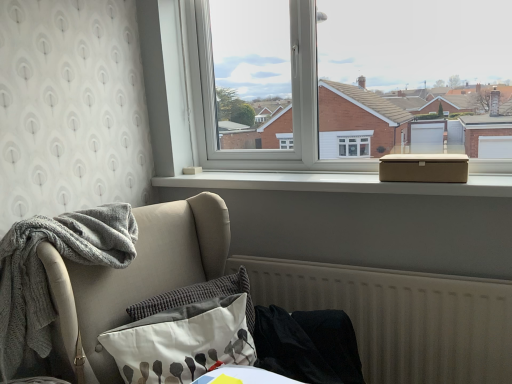
You are a GUI agent. You are given a task and a screenshot of the screen. Output one action in this format:
    pyautogui.click(x=<x>, y=<y>)
    Task: Click on the white smooth window sill at upper center
    
    Given the screenshot: What is the action you would take?
    coord(338,183)

The image size is (512, 384). Describe the element at coordinates (307, 345) in the screenshot. I see `black fabric at lower right, the 2th material positioned from the left` at that location.

This screenshot has width=512, height=384. What do you see at coordinates (424, 168) in the screenshot? I see `brown cardboard box at upper right` at bounding box center [424, 168].

Describe the element at coordinates (198, 297) in the screenshot. The width and height of the screenshot is (512, 384). I see `textured gray pillow at lower center, marked as the second pillow in a front-to-back arrangement` at that location.

The width and height of the screenshot is (512, 384). What do you see at coordinates (400, 317) in the screenshot?
I see `beige textured radiator at lower right` at bounding box center [400, 317].

Measure the distance between point (244, 323) and camera.

Point (244, 323) and camera are 1.39 meters apart from each other.

This screenshot has width=512, height=384. What are the coordinates of `white smooth window sill at upper center` in the screenshot? It's located at (338, 183).

Which object is further away from the camera, textured gray pillow at lower left, which is the 2th pillow from back to front, or black fabric at lower right, the 2th material positioned from the left?

black fabric at lower right, the 2th material positioned from the left, is more distant.

From a real-world perspective, is textured gray pillow at lower left, marked as the first pillow in a front-to-back arrangement, physically located above or below black fabric at lower right, arranged as the first material when viewed from the right?

From a real-world perspective, textured gray pillow at lower left, marked as the first pillow in a front-to-back arrangement, is physically above black fabric at lower right, arranged as the first material when viewed from the right.

Does textured gray pillow at lower left, which is the 2th pillow from back to front, have a larger size compared to black fabric at lower right, arranged as the first material when viewed from the right?

Yes.

Would you say textured gray pillow at lower left, marked as the first pillow in a front-to-back arrangement, is inside or outside black fabric at lower right, arranged as the first material when viewed from the right?

textured gray pillow at lower left, marked as the first pillow in a front-to-back arrangement, is spatially situated outside black fabric at lower right, arranged as the first material when viewed from the right.

Does beige textured radiator at lower right appear on the right side of brown cardboard box at upper right?

No, beige textured radiator at lower right is not to the right of brown cardboard box at upper right.

Can you confirm if beige textured radiator at lower right is smaller than brown cardboard box at upper right?

Incorrect, beige textured radiator at lower right is not smaller in size than brown cardboard box at upper right.

Is beige textured radiator at lower right taller than brown cardboard box at upper right?

Indeed, beige textured radiator at lower right has a greater height compared to brown cardboard box at upper right.

Is beige textured radiator at lower right positioned beyond the bounds of brown cardboard box at upper right?

Yes, beige textured radiator at lower right is outside of brown cardboard box at upper right.

Which object is positioned more to the left, beige textured radiator at lower right or white smooth window sill at upper center?

Positioned to the left is white smooth window sill at upper center.

From the picture: From a real-world perspective, between beige textured radiator at lower right and white smooth window sill at upper center, who is vertically lower?

beige textured radiator at lower right.

Considering the relative sizes of beige textured radiator at lower right and white smooth window sill at upper center in the image provided, is beige textured radiator at lower right taller than white smooth window sill at upper center?

Yes.

Consider the image. Is beige textured radiator at lower right taller than textured gray pillow at lower center, acting as the first pillow starting from the back?

Yes, beige textured radiator at lower right is taller than textured gray pillow at lower center, acting as the first pillow starting from the back.

Is point (469, 296) positioned before point (219, 280)?

Yes, it is in front of point (219, 280).

Is beige textured radiator at lower right in front of or behind textured gray pillow at lower center, acting as the first pillow starting from the back, in the image?

beige textured radiator at lower right is positioned farther from the viewer than textured gray pillow at lower center, acting as the first pillow starting from the back.

At what (x,y) coordinates should I click in order to perform the action: click on window sill positioned vertically above the black fabric at lower right, the 2th material positioned from the left (from a real-world perspective). Please return your answer as a coordinate pair (x, y). This screenshot has height=384, width=512. Looking at the image, I should click on (338, 183).

Which of these two, black fabric at lower right, arranged as the first material when viewed from the right, or white smooth window sill at upper center, is smaller?

Smaller between the two is black fabric at lower right, arranged as the first material when viewed from the right.

Is black fabric at lower right, arranged as the first material when viewed from the right, inside the boundaries of white smooth window sill at upper center, or outside?

black fabric at lower right, arranged as the first material when viewed from the right, is not enclosed by white smooth window sill at upper center.

Is black fabric at lower right, arranged as the first material when viewed from the right, thinner than white smooth window sill at upper center?

No, black fabric at lower right, arranged as the first material when viewed from the right, is not thinner than white smooth window sill at upper center.

Which object is closer to the camera, textured gray pillow at lower center, acting as the first pillow starting from the back, or gray knitted blanket at left, arranged as the 1th material when viewed from the left?

Positioned in front is gray knitted blanket at left, arranged as the 1th material when viewed from the left.

What's the angular difference between textured gray pillow at lower center, marked as the second pillow in a front-to-back arrangement, and gray knitted blanket at left, arranged as the 1th material when viewed from the left,'s facing directions?

The facing directions of textured gray pillow at lower center, marked as the second pillow in a front-to-back arrangement, and gray knitted blanket at left, arranged as the 1th material when viewed from the left, are 40.1 degrees apart.

Would you say textured gray pillow at lower center, acting as the first pillow starting from the back, contains gray knitted blanket at left, which is the 2th material from right to left?

No, textured gray pillow at lower center, acting as the first pillow starting from the back, does not contain gray knitted blanket at left, which is the 2th material from right to left.

Could you tell me if textured gray pillow at lower center, acting as the first pillow starting from the back, is facing gray knitted blanket at left, arranged as the 1th material when viewed from the left?

No, textured gray pillow at lower center, acting as the first pillow starting from the back, does not turn towards gray knitted blanket at left, arranged as the 1th material when viewed from the left.

Consider the image. Considering the sizes of objects textured gray pillow at lower left, which is the 2th pillow from back to front, and beige textured radiator at lower right in the image provided, who is wider, textured gray pillow at lower left, which is the 2th pillow from back to front, or beige textured radiator at lower right?

textured gray pillow at lower left, which is the 2th pillow from back to front, is wider.

The image size is (512, 384). Identify the location of radiator beneath the textured gray pillow at lower left, marked as the first pillow in a front-to-back arrangement (from a real-world perspective). (400, 317).

Between textured gray pillow at lower left, marked as the first pillow in a front-to-back arrangement, and beige textured radiator at lower right, which one has smaller size?

textured gray pillow at lower left, marked as the first pillow in a front-to-back arrangement, is smaller.

In the image, there is a textured gray pillow at lower left, marked as the first pillow in a front-to-back arrangement. At what (x,y) coordinates should I click in order to perform the action: click on material below it (from a real-world perspective). Please return your answer as a coordinate pair (x, y). This screenshot has width=512, height=384. Looking at the image, I should click on (307, 345).

In the image, there is a brown cardboard box at upper right. Where is `radiator below it (from the image's perspective)`? radiator below it (from the image's perspective) is located at coordinates (400, 317).

Based on their spatial positions, is brown cardboard box at upper right or white smooth window sill at upper center closer to textured gray pillow at lower left, marked as the first pillow in a front-to-back arrangement?

The object closer to textured gray pillow at lower left, marked as the first pillow in a front-to-back arrangement, is white smooth window sill at upper center.

Looking at the image, which one is located further to textured gray pillow at lower left, which is the 2th pillow from back to front, beige textured radiator at lower right or gray knitted blanket at left, arranged as the 1th material when viewed from the left?

beige textured radiator at lower right is further to textured gray pillow at lower left, which is the 2th pillow from back to front.

When comparing their distances from black fabric at lower right, the 2th material positioned from the left, does white smooth window sill at upper center or textured gray pillow at lower center, marked as the second pillow in a front-to-back arrangement, seem closer?

Based on the image, textured gray pillow at lower center, marked as the second pillow in a front-to-back arrangement, appears to be nearer to black fabric at lower right, the 2th material positioned from the left.

When comparing their distances from gray knitted blanket at left, which is the 2th material from right to left, does black fabric at lower right, the 2th material positioned from the left, or beige textured radiator at lower right seem further?

beige textured radiator at lower right lies further to gray knitted blanket at left, which is the 2th material from right to left, than the other object.

Based on their spatial positions, is black fabric at lower right, the 2th material positioned from the left, or beige textured radiator at lower right further from white smooth window sill at upper center?

black fabric at lower right, the 2th material positioned from the left, is further to white smooth window sill at upper center.

When comparing their distances from textured gray pillow at lower left, which is the 2th pillow from back to front, does black fabric at lower right, arranged as the first material when viewed from the right, or brown cardboard box at upper right seem closer?

black fabric at lower right, arranged as the first material when viewed from the right.

Based on their spatial positions, is textured gray pillow at lower center, acting as the first pillow starting from the back, or brown cardboard box at upper right further from beige textured radiator at lower right?

brown cardboard box at upper right lies further to beige textured radiator at lower right than the other object.

Based on their spatial positions, is beige textured radiator at lower right or white smooth window sill at upper center further from textured gray pillow at lower center, marked as the second pillow in a front-to-back arrangement?

The object further to textured gray pillow at lower center, marked as the second pillow in a front-to-back arrangement, is white smooth window sill at upper center.

The height and width of the screenshot is (384, 512). Identify the location of pillow between gray knitted blanket at left, which is the 2th material from right to left, and textured gray pillow at lower left, marked as the first pillow in a front-to-back arrangement, from left to right. (198, 297).

This screenshot has height=384, width=512. Find the location of `radiator between gray knitted blanket at left, arranged as the 1th material when viewed from the left, and brown cardboard box at upper right`. radiator between gray knitted blanket at left, arranged as the 1th material when viewed from the left, and brown cardboard box at upper right is located at coordinates (400, 317).

At what (x,y) coordinates should I click in order to perform the action: click on material between textured gray pillow at lower center, marked as the second pillow in a front-to-back arrangement, and brown cardboard box at upper right. Please return your answer as a coordinate pair (x, y). Looking at the image, I should click on (307, 345).

I want to click on window sill between gray knitted blanket at left, which is the 2th material from right to left, and brown cardboard box at upper right from left to right, so click(x=338, y=183).